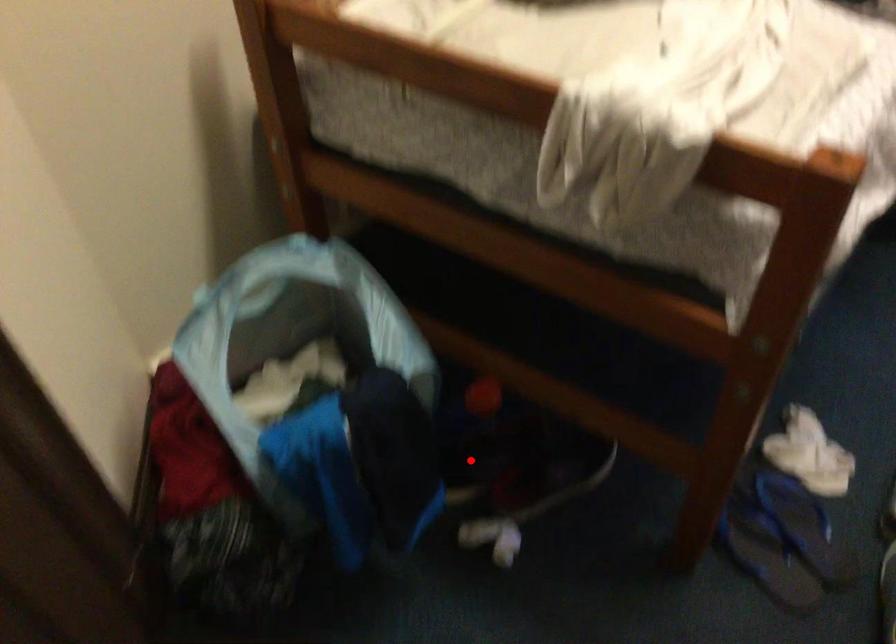
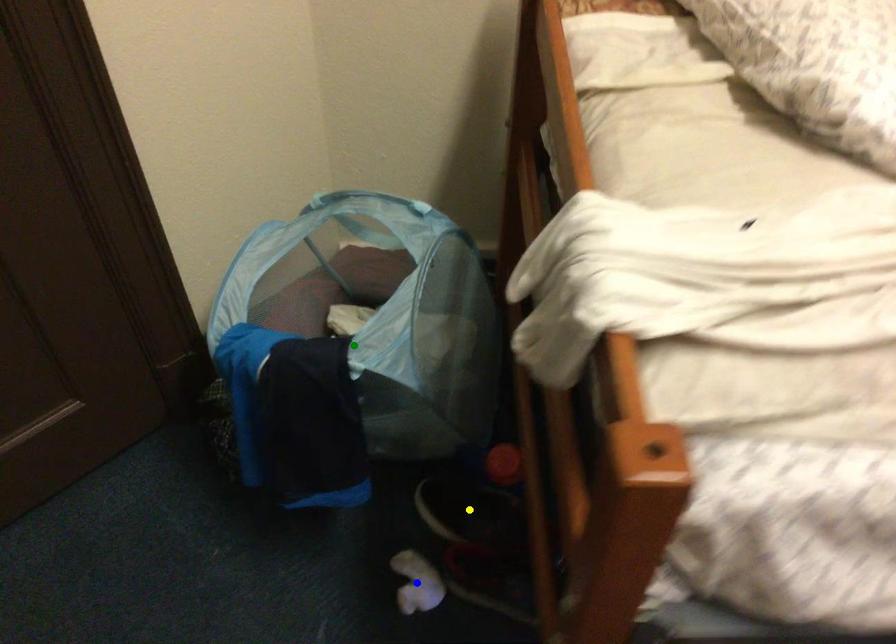
Question: I am providing you with two images of the same scene from different viewpoints. A red point is marked on the first image. You are given multiple points on the second image. In image 2, which mark is for the same physical point as the one in image 1?

Choices:
 (A) green point
 (B) blue point
 (C) yellow point

Answer: (C)